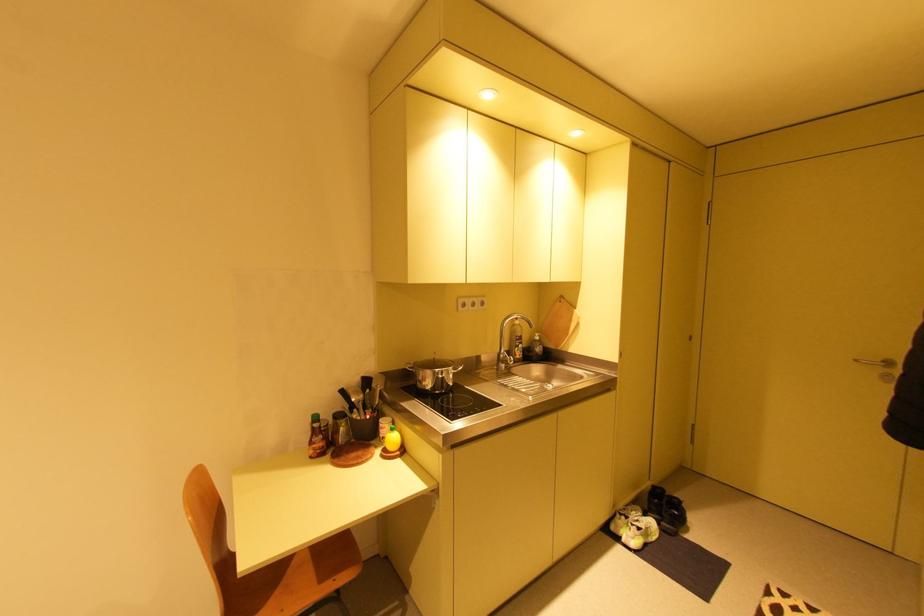
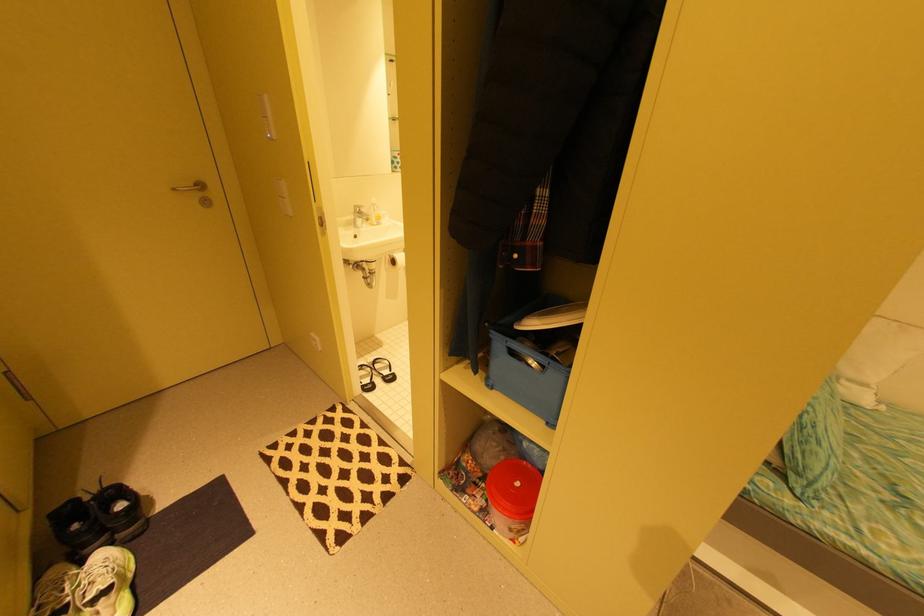
In the second image, find the point that corresponds to pixel 673 493 in the first image.

(93, 499)